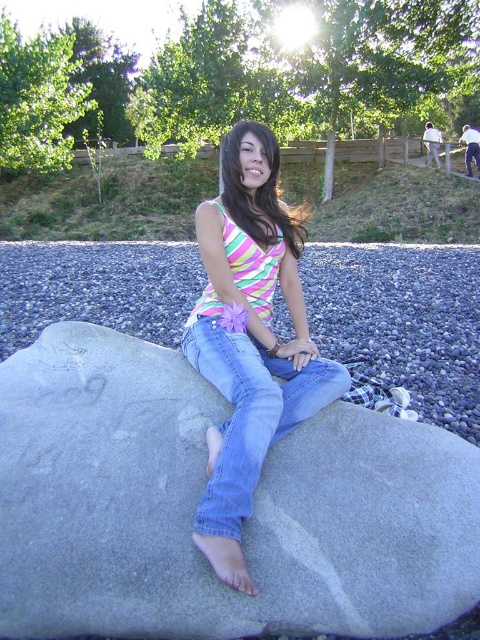
Based on the scene description, can you determine which clothing item is closer to the camera between the striped fabric tank top at center and the denim jeans at center?

The striped fabric tank top at center is in front of the denim jeans at center, so it is closer to the camera.

You are a photographer trying to capture a closeup of the gray smooth boulder at center and the striped fabric tank top at center in the scene. The camera you are using has a maximum focus range of 15 inches. Will both objects be in focus at the same time?

The gray smooth boulder at center and striped fabric tank top at center are 15.18 inches apart from each other. Since the distance between them exceeds the camera maximum focus range of 15 inches, they cannot be in focus simultaneously.